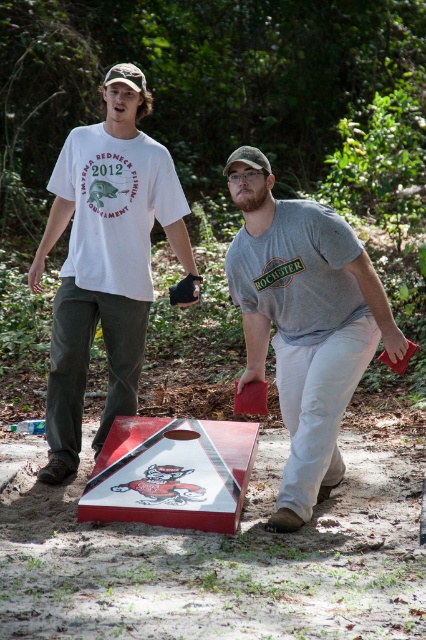
Question: Which point is farther to the camera?

Choices:
 (A) white cotton t-shirt at upper left
 (B) matte red cornhole board at center

Answer: (A)

Question: Can you confirm if camouflage fabric baseball cap at upper center is smaller than camouflage fabric baseball cap at center?

Choices:
 (A) yes
 (B) no

Answer: (B)

Question: Can you confirm if red wood cornhole board at center is positioned above camouflage fabric baseball cap at center?

Choices:
 (A) no
 (B) yes

Answer: (A)

Question: Among these objects, which one is nearest to the camera?

Choices:
 (A) red wood cornhole board at center
 (B) matte red cornhole board at center
 (C) camouflage fabric baseball cap at center

Answer: (A)

Question: Is matte red cornhole board at center positioned at the back of camouflage fabric baseball cap at upper center?

Choices:
 (A) yes
 (B) no

Answer: (B)

Question: Estimate the real-world distances between objects in this image. Which object is closer to the matte red cornhole board at center?

Choices:
 (A) white cotton t-shirt at upper left
 (B) camouflage fabric baseball cap at upper center

Answer: (A)